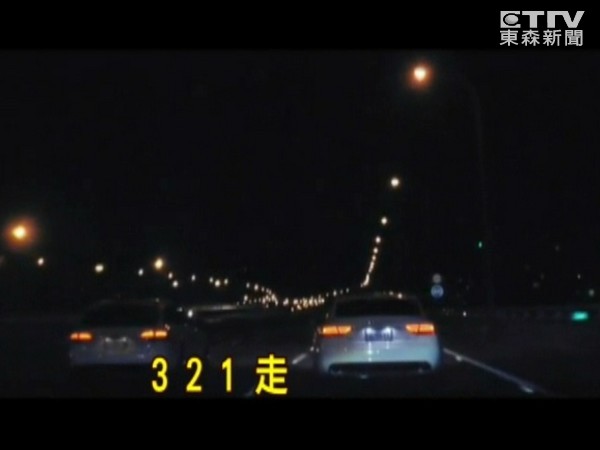
I want to click on green small light, so click(575, 320).